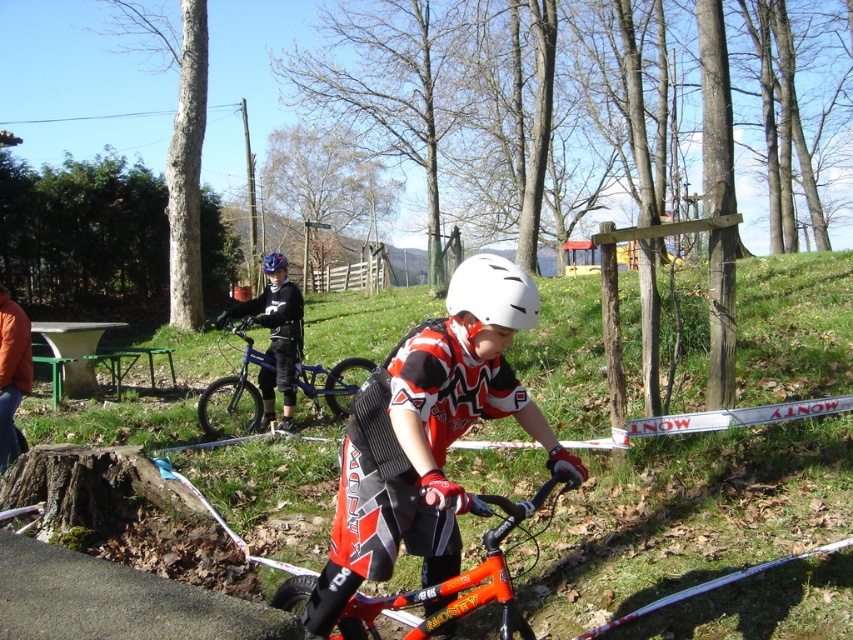
You are a delivery person who needs to place a new bike exactly at the same position as the blue metallic bicycle at center. What coordinates should you use for placement?

The blue metallic bicycle at center should be placed at coordinates point [235,396].

You are planning to park your bike in a narrow space that can only accommodate a bike with a width of 60 cm. You have to choose between the orange matte mountain bike at center and the blue metallic bicycle at center. Which bike should you choose?

The orange matte mountain bike at center has a larger width than the blue metallic bicycle at center. Since the space can only accommodate a bike with a width of 60 cm, you should choose the blue metallic bicycle at center as it is narrower and more likely to fit within the 60 cm limit.